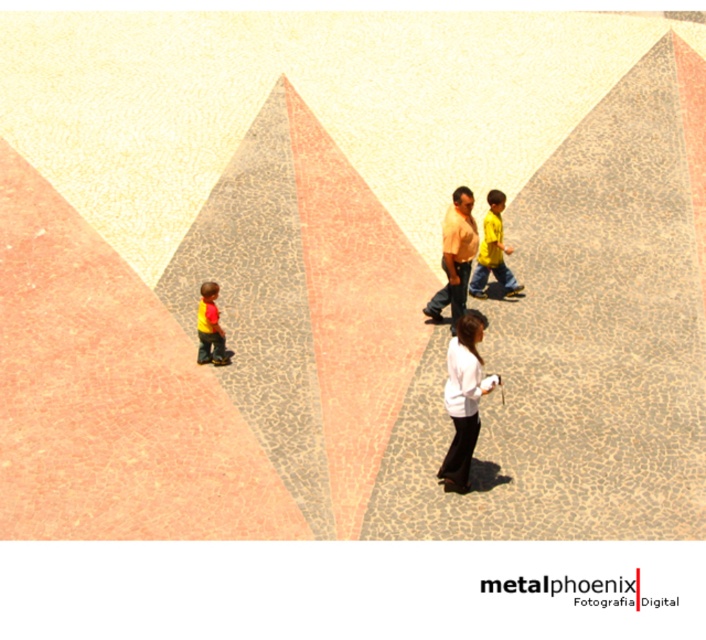
Question: Based on their relative distances, which object is farther from the matte pink shirt at center?

Choices:
 (A) yellow matte shirt at center
 (B) white matte shirt at center
 (C) yellow fabric shirt at lower left

Answer: (B)

Question: Where is matte pink shirt at center located in relation to yellow matte shirt at center in the image?

Choices:
 (A) above
 (B) below

Answer: (B)

Question: Which of the following is the closest to the observer?

Choices:
 (A) yellow matte shirt at center
 (B) yellow fabric shirt at lower left
 (C) white matte shirt at center
 (D) matte pink shirt at center

Answer: (C)

Question: Which of the following is the farthest from the observer?

Choices:
 (A) (454, 468)
 (B) (486, 202)
 (C) (198, 355)
 (D) (454, 275)

Answer: (B)

Question: Does white matte shirt at center have a lesser width compared to matte pink shirt at center?

Choices:
 (A) no
 (B) yes

Answer: (B)

Question: Can you confirm if white matte shirt at center is bigger than matte pink shirt at center?

Choices:
 (A) yes
 (B) no

Answer: (B)